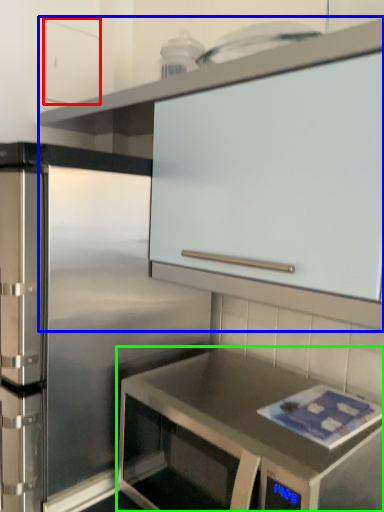
Question: Which is nearer to the cabinetry (highlighted by a red box)? cabinetry (highlighted by a blue box) or countertop (highlighted by a green box).

Choices:
 (A) cabinetry
 (B) countertop

Answer: (A)